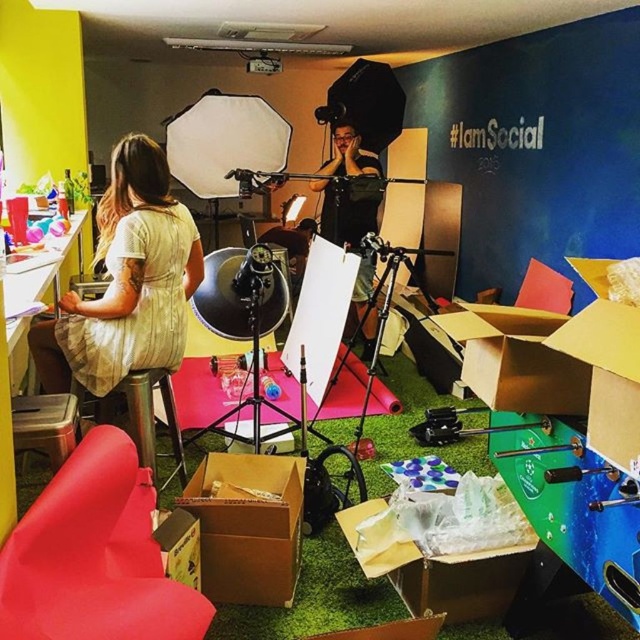
Question: Is matte yellow dress at left positioned in front of brown cardboard box at center?

Choices:
 (A) yes
 (B) no

Answer: (B)

Question: Which point appears closest to the camera in this image?

Choices:
 (A) (324, 392)
 (B) (278, 520)

Answer: (B)

Question: Is the position of matte yellow dress at left more distant than that of cardboard box at center?

Choices:
 (A) yes
 (B) no

Answer: (A)

Question: Which of the following is the closest to the observer?

Choices:
 (A) (365, 324)
 (B) (490, 605)

Answer: (B)

Question: Among these objects, which one is nearest to the camera?

Choices:
 (A) brown cardboard box at center
 (B) black matte shirt at center
 (C) matte black tripod at center
 (D) matte yellow dress at left

Answer: (A)

Question: Is cardboard box at center positioned at the back of black matte shirt at center?

Choices:
 (A) no
 (B) yes

Answer: (A)